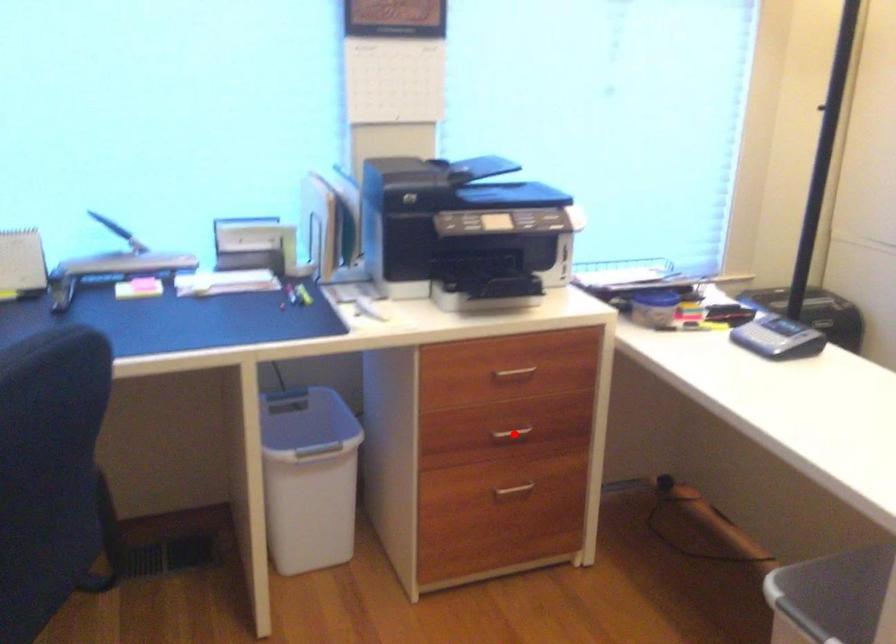
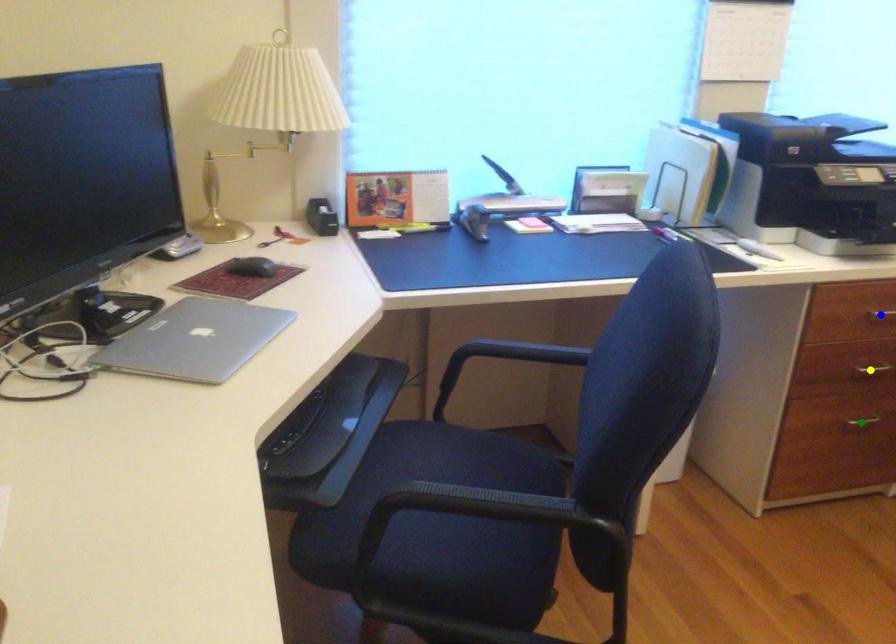
Question: I am providing you with two images of the same scene from different viewpoints. A red point is marked on the first image. You are given multiple points on the second image. Which spot in image 2 lines up with the point in image 1?

Choices:
 (A) yellow point
 (B) green point
 (C) blue point

Answer: (A)